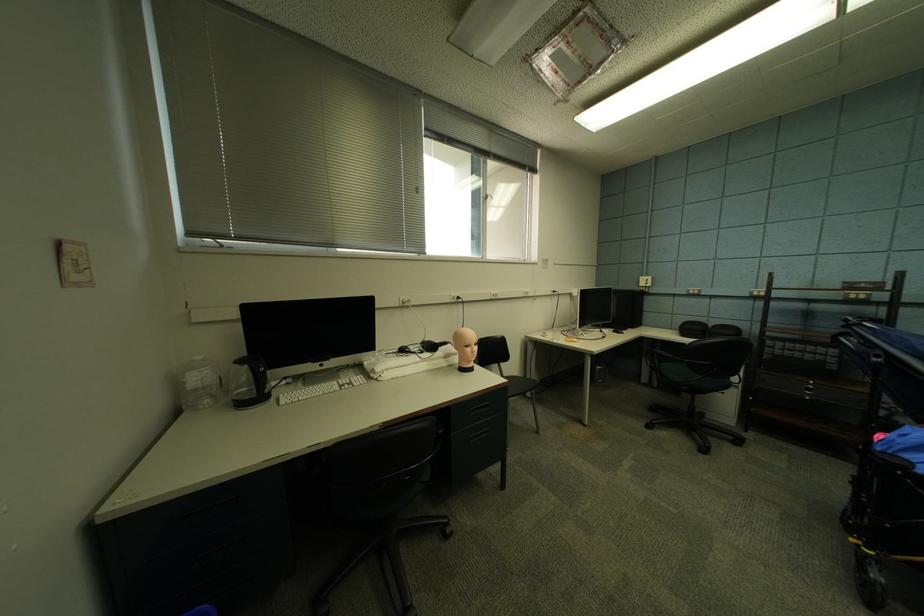
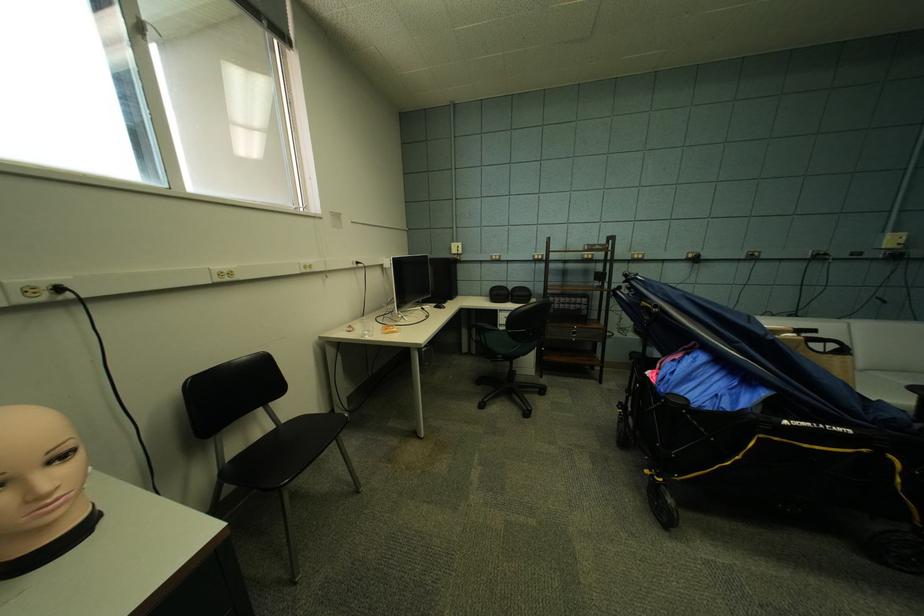
Locate, in the second image, the point that corresponds to point (494, 203) in the first image.

(154, 42)